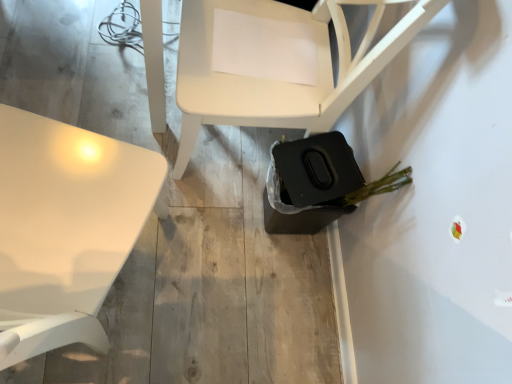
Question: Is white glossy table at upper left situated inside matte white chair at center or outside?

Choices:
 (A) inside
 (B) outside

Answer: (B)

Question: From a real-world perspective, is white glossy table at upper left above or below matte white chair at center?

Choices:
 (A) above
 (B) below

Answer: (A)

Question: Is point (50, 263) closer or farther from the camera than point (352, 62)?

Choices:
 (A) closer
 (B) farther

Answer: (A)

Question: Considering the relative positions of matte white chair at center and white glossy table at upper left in the image provided, is matte white chair at center to the left or to the right of white glossy table at upper left?

Choices:
 (A) right
 (B) left

Answer: (A)

Question: From the image's perspective, is matte white chair at center located above or below white glossy table at upper left?

Choices:
 (A) above
 (B) below

Answer: (A)

Question: From a real-world perspective, relative to white glossy table at upper left, is matte white chair at center vertically above or below?

Choices:
 (A) above
 (B) below

Answer: (B)

Question: Considering the positions of matte white chair at center and white glossy table at upper left in the image, is matte white chair at center wider or thinner than white glossy table at upper left?

Choices:
 (A) thin
 (B) wide

Answer: (A)